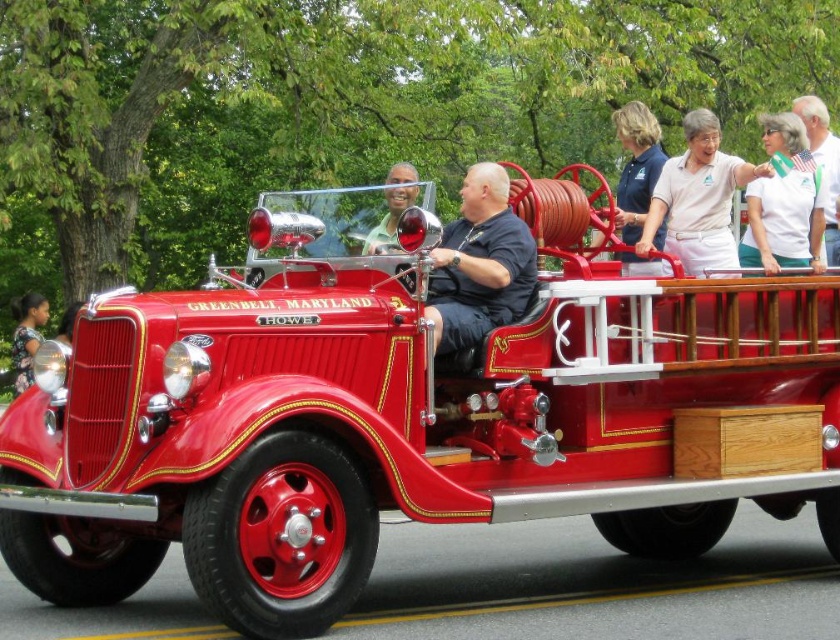
You are a photographer at the event and want to capture both the white cotton shirt at upper center and the matte blue polo shirt at upper center in a single frame. Which shirt should you focus on to ensure both are visible without cropping?

The white cotton shirt at upper center occupies less space than the matte blue polo shirt at upper center, so focusing on the matte blue polo shirt at upper center would allow both shirts to fit within the frame since it takes up more space and the smaller one can be positioned alongside it.

You are a photographer setting up for a group photo at the event. You need to position two people wearing the white cotton shirt at upper center and the matte green shirt at center. The photographer wants to ensure that the wider shirt does not block the narrower one. Which shirt should be placed closer to the camera to prevent blocking?

The white cotton shirt at upper center might be wider than the matte green shirt at center, so placing the wider white cotton shirt at upper center closer to the camera would help prevent it from blocking the narrower matte green shirt at center.

You are attending a parade and see two shirts displayed on mannequins on the vintage fire truck. The white cotton shirt at upper center and the matte blue polo shirt at upper center. Which shirt is closer to the bottom of the truck?

The white cotton shirt at upper center is positioned under the matte blue polo shirt at upper center, so it is closer to the bottom of the truck.